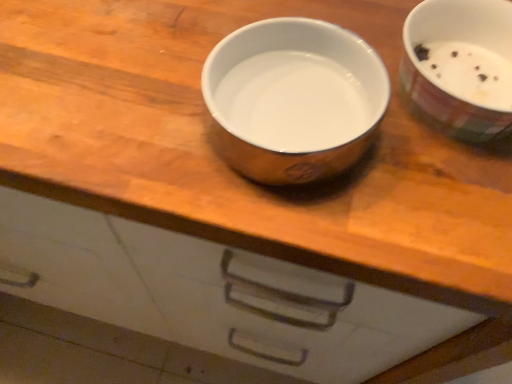
The width and height of the screenshot is (512, 384). Find the location of `vacant space that's between white glossy bowl at upper right, which appears as the first tableware when viewed from the right, and satin silver bowl at center, marked as the 1th tableware in a left-to-right arrangement`. vacant space that's between white glossy bowl at upper right, which appears as the first tableware when viewed from the right, and satin silver bowl at center, marked as the 1th tableware in a left-to-right arrangement is located at coordinates (402, 145).